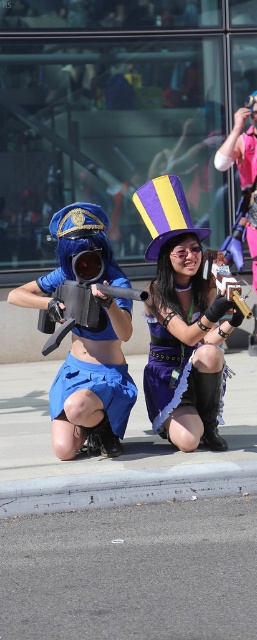
Question: Considering the real-world distances, which object is closest to the purple velvet top hat at upper center?

Choices:
 (A) gray asphalt at lower center
 (B) matte black gun at center
 (C) gray asphalt curb at lower center

Answer: (B)

Question: Based on their relative distances, which object is farther from the purple velvet top hat at upper center?

Choices:
 (A) gray asphalt curb at lower center
 (B) matte blue uniform at left
 (C) matte black gun at center

Answer: (A)

Question: Can you confirm if purple velvet top hat at upper center is smaller than gray asphalt curb at lower center?

Choices:
 (A) no
 (B) yes

Answer: (A)

Question: Which point is closer to the camera?

Choices:
 (A) matte black gun at center
 (B) purple velvet top hat at upper center
 (C) gray asphalt curb at lower center
 (D) gray asphalt at lower center

Answer: (D)

Question: Can you confirm if matte black gun at center is positioned above black leather boot at lower center?

Choices:
 (A) no
 (B) yes

Answer: (B)

Question: Does purple velvet top hat at upper center appear over matte black gun at center?

Choices:
 (A) no
 (B) yes

Answer: (A)